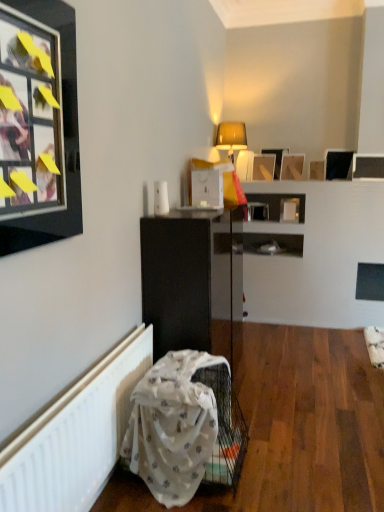
Question: From the image's perspective, would you say wooden picture frame at upper center, the sixth picture frame when ordered from front to back, is shown under black glossy picture frame at upper right, arranged as the second picture frame when viewed from the right?

Choices:
 (A) no
 (B) yes

Answer: (B)

Question: Is the position of wooden picture frame at upper center, which is the 6th picture frame in right-to-left order, less distant than that of black glossy picture frame at upper right, the sixth picture frame in the left-to-right sequence?

Choices:
 (A) no
 (B) yes

Answer: (A)

Question: Are wooden picture frame at upper center, which is the 6th picture frame in right-to-left order, and black glossy picture frame at upper right, marked as the fourth picture frame in a front-to-back arrangement, located far from each other?

Choices:
 (A) no
 (B) yes

Answer: (A)

Question: Can you confirm if wooden picture frame at upper center, positioned as the 2th picture frame in left-to-right order, is positioned to the left of black glossy picture frame at upper right, arranged as the second picture frame when viewed from the right?

Choices:
 (A) yes
 (B) no

Answer: (A)

Question: Would you say black glossy picture frame at upper right, the sixth picture frame in the left-to-right sequence, is part of wooden picture frame at upper center, which is the 6th picture frame in right-to-left order,'s contents?

Choices:
 (A) yes
 (B) no

Answer: (B)

Question: Does point (226, 150) appear closer or farther from the camera than point (276, 168)?

Choices:
 (A) closer
 (B) farther

Answer: (A)

Question: From their relative heights in the image, would you say matte yellow table lamp at upper center is taller or shorter than wooden picture frame at upper center, which appears as the first picture frame when viewed from the back?

Choices:
 (A) short
 (B) tall

Answer: (B)

Question: Visually, is matte yellow table lamp at upper center positioned to the left or to the right of wooden picture frame at upper center, the seventh picture frame in the front-to-back sequence?

Choices:
 (A) right
 (B) left

Answer: (B)

Question: Considering their positions, is matte yellow table lamp at upper center located in front of or behind wooden picture frame at upper center, which ranks as the third picture frame in left-to-right order?

Choices:
 (A) behind
 (B) front

Answer: (B)

Question: From the image's perspective, is wooden picture frame at upper center, the fifth picture frame from the back, above or below matte yellow table lamp at upper center?

Choices:
 (A) above
 (B) below

Answer: (B)

Question: Is point (321, 178) positioned closer to the camera than point (230, 153)?

Choices:
 (A) farther
 (B) closer

Answer: (A)

Question: From their relative heights in the image, would you say wooden picture frame at upper center, which appears as the 5th picture frame when viewed from the left, is taller or shorter than matte yellow table lamp at upper center?

Choices:
 (A) tall
 (B) short

Answer: (B)

Question: From a real-world perspective, relative to matte yellow table lamp at upper center, is wooden picture frame at upper center, which appears as the 5th picture frame when viewed from the left, vertically above or below?

Choices:
 (A) above
 (B) below

Answer: (B)

Question: In terms of height, does wooden picture frame at upper center, positioned as the third picture frame in front-to-back order, look taller or shorter compared to matte black picture frame at upper right, which is the 1th picture frame from right to left?

Choices:
 (A) tall
 (B) short

Answer: (B)

Question: Looking at their shapes, would you say wooden picture frame at upper center, the fifth picture frame from the back, is wider or thinner than matte black picture frame at upper right, the 2th picture frame when ordered from front to back?

Choices:
 (A) wide
 (B) thin

Answer: (A)